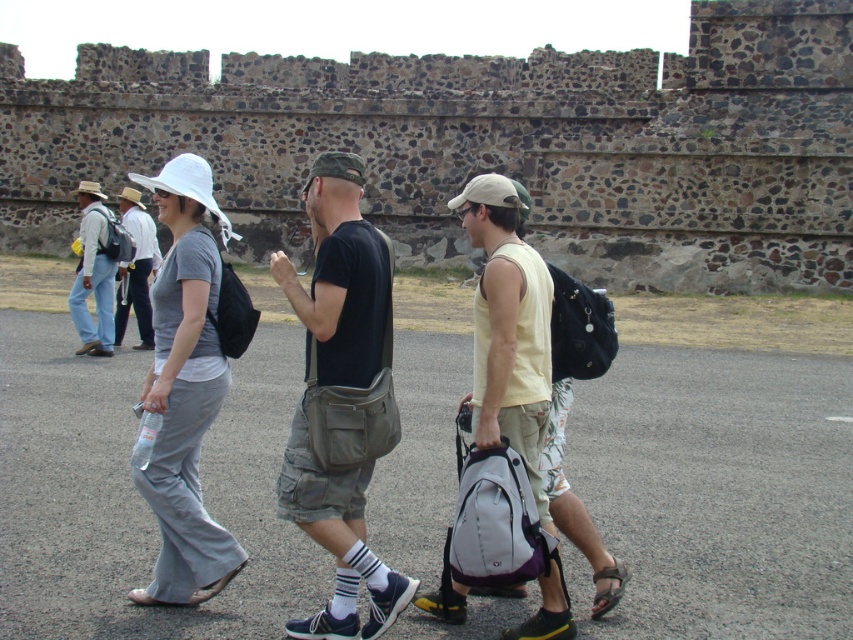
You are a photographer trying to capture the group in the scene. You notice the yellow cotton tank top at center and the white fabric backpack at center. Which object should you focus on if you want to photograph the wider one?

The yellow cotton tank top at center is wider than the white fabric backpack at center, so focus on the yellow cotton tank top at center for the wider object.